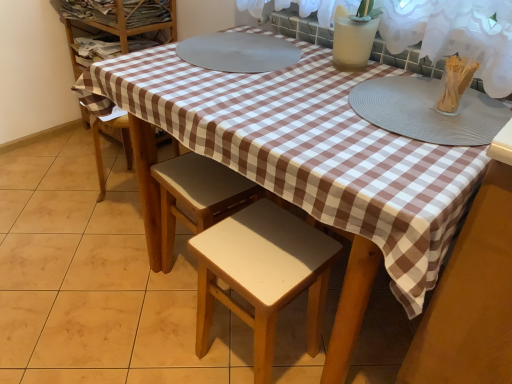
Where is `free point above white matte stool at lower center, which ranks as the first stool in front-to-back order (from a real-world perspective)`? free point above white matte stool at lower center, which ranks as the first stool in front-to-back order (from a real-world perspective) is located at coordinates (263, 246).